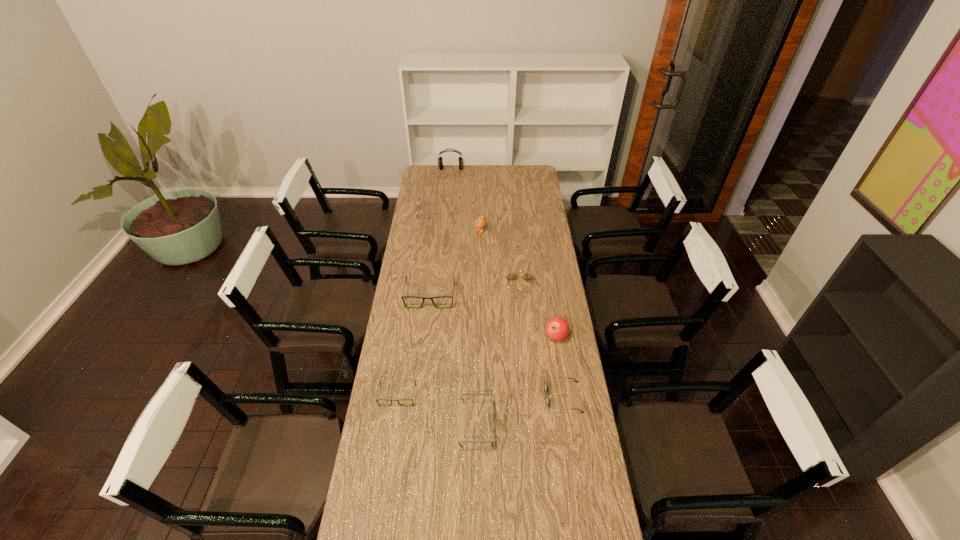
Where is `the rightmost black spectacles`? This screenshot has height=540, width=960. the rightmost black spectacles is located at coordinates (492, 440).

Find the location of a particular element. The image size is (960, 540). the second spectacles from right to left is located at coordinates (492, 440).

The width and height of the screenshot is (960, 540). Find the location of `the rightmost spectacles`. the rightmost spectacles is located at coordinates (511, 276).

Where is `the nearer yellow spectacles`? the nearer yellow spectacles is located at coordinates (511, 276).

At what (x,y) coordinates should I click in order to perform the action: click on the smallest black spectacles. Please return your answer as a coordinate pair (x, y). The width and height of the screenshot is (960, 540). Looking at the image, I should click on (391, 400).

The height and width of the screenshot is (540, 960). Identify the location of sunglasses. (545, 386).

Image resolution: width=960 pixels, height=540 pixels. Identify the location of free location located on the ear cups of the headset. (447, 205).

In order to click on vacant space located on the face of the teddy bear in this screenshot , I will do `click(414, 232)`.

Where is `blank space located on the face of the teddy bear`? blank space located on the face of the teddy bear is located at coordinates (x=419, y=232).

Where is `free space located on the face of the teddy bear`? free space located on the face of the teddy bear is located at coordinates pyautogui.click(x=414, y=232).